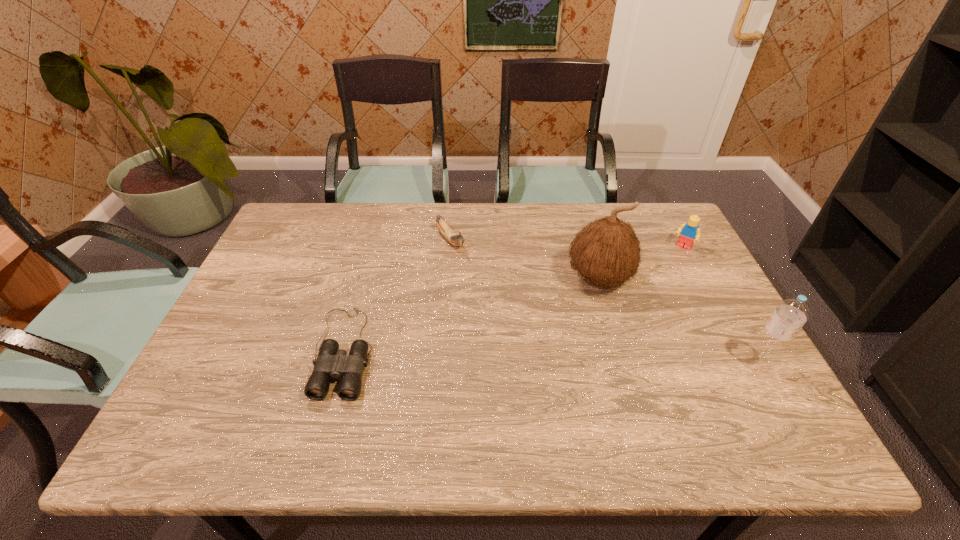
Where is `the leftmost object`? the leftmost object is located at coordinates (332, 362).

Where is `binoculars`? Image resolution: width=960 pixels, height=540 pixels. binoculars is located at coordinates pos(332,362).

Locate an element on the screen. The width and height of the screenshot is (960, 540). water bottle is located at coordinates (790, 315).

The width and height of the screenshot is (960, 540). I want to click on banana, so click(x=457, y=240).

You are a GUI agent. You are given a task and a screenshot of the screen. Output one action in this format:
    pyautogui.click(x=<x>, y=<y>)
    Task: Click on the fourth tallest object
    Image resolution: width=960 pixels, height=540 pixels.
    Given the screenshot: What is the action you would take?
    pyautogui.click(x=457, y=240)

I want to click on coconut, so click(x=606, y=252).

You are a GUI agent. You are given a task and a screenshot of the screen. Output one action in this format:
    pyautogui.click(x=<x>, y=<y>)
    Task: Click on the third object from left to right
    This screenshot has width=960, height=540.
    Given the screenshot: What is the action you would take?
    pyautogui.click(x=606, y=252)

Find the location of `the third tallest object`. the third tallest object is located at coordinates (689, 232).

Locate an element on the screen. The image size is (960, 540). vacant area located on the left of the fourth shortest object is located at coordinates (678, 363).

You are a GUI agent. You are given a task and a screenshot of the screen. Output one action in this format:
    pyautogui.click(x=<x>, y=<y>)
    Task: Click on the free location located 0.060m on the peel of the banana
    This screenshot has width=960, height=540.
    Given the screenshot: What is the action you would take?
    pyautogui.click(x=467, y=265)